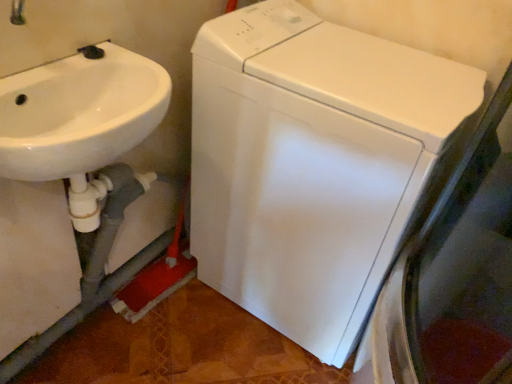
Image resolution: width=512 pixels, height=384 pixels. What do you see at coordinates (313, 164) in the screenshot?
I see `white glossy washing machine at center` at bounding box center [313, 164].

From the picture: Measure the distance between point (x=318, y=153) and camera.

The distance of point (x=318, y=153) from camera is 37.17 inches.

Find the location of a particular element. The height and width of the screenshot is (384, 512). white glossy washing machine at center is located at coordinates (313, 164).

In order to click on white glossy sink at left in this screenshot , I will do (79, 113).

What do you see at coordinates (79, 113) in the screenshot?
I see `white glossy sink at left` at bounding box center [79, 113].

This screenshot has width=512, height=384. I want to click on white glossy washing machine at center, so click(313, 164).

Can you confirm if white glossy sink at left is positioned to the left of white glossy washing machine at center?

Yes.

Does white glossy sink at left come behind white glossy washing machine at center?

No, it is in front of white glossy washing machine at center.

Does point (156, 114) appear closer or farther from the camera than point (244, 127)?

Clearly, point (156, 114) is closer to the camera than point (244, 127).

From the image's perspective, is white glossy sink at left positioned above or below white glossy washing machine at center?

From the image's perspective, white glossy sink at left appears above white glossy washing machine at center.

From a real-world perspective, which is physically above, white glossy sink at left or white glossy washing machine at center?

From a 3D spatial view, white glossy sink at left is above.

Which object is wider, white glossy sink at left or white glossy washing machine at center?

With larger width is white glossy washing machine at center.

Is white glossy sink at left taller or shorter than white glossy washing machine at center?

white glossy sink at left is shorter than white glossy washing machine at center.

Who is smaller, white glossy sink at left or white glossy washing machine at center?

Smaller between the two is white glossy sink at left.

Does white glossy sink at left contain white glossy washing machine at center?

Actually, white glossy washing machine at center is outside white glossy sink at left.

Is white glossy sink at left not near white glossy washing machine at center?

No, white glossy sink at left is in close proximity to white glossy washing machine at center.

Is white glossy sink at left facing towards white glossy washing machine at center?

No, white glossy sink at left is not turned towards white glossy washing machine at center.

Locate an element on the screen. The width and height of the screenshot is (512, 384). sink above the white glossy washing machine at center (from the image's perspective) is located at coordinates (79, 113).

Does white glossy washing machine at center appear on the left side of white glossy sink at left?

Incorrect, white glossy washing machine at center is not on the left side of white glossy sink at left.

Is white glossy washing machine at center in front of or behind white glossy sink at left in the image?

Clearly, white glossy washing machine at center is behind white glossy sink at left.

Does point (248, 284) come farther from viewer compared to point (30, 91)?

Yes.

From the image's perspective, would you say white glossy washing machine at center is shown under white glossy sink at left?

Indeed, from the image's perspective, white glossy washing machine at center is shown beneath white glossy sink at left.

From a real-world perspective, between white glossy washing machine at center and white glossy sink at left, who is vertically lower?

In real-world perspective, white glossy washing machine at center is lower.

Which of these two, white glossy washing machine at center or white glossy sink at left, is wider?

white glossy washing machine at center.

Considering the relative sizes of white glossy washing machine at center and white glossy sink at left in the image provided, is white glossy washing machine at center taller than white glossy sink at left?

Yes.

Is white glossy washing machine at center bigger or smaller than white glossy sink at left?

white glossy washing machine at center is bigger than white glossy sink at left.

Is white glossy washing machine at center positioned beyond the bounds of white glossy sink at left?

white glossy washing machine at center is positioned outside white glossy sink at left.

Is white glossy washing machine at center far away from white glossy sink at left?

white glossy washing machine at center is near white glossy sink at left, not far away.

Could you tell me if white glossy washing machine at center is facing white glossy sink at left?

Yes, white glossy washing machine at center is facing white glossy sink at left.

Consider the image. How different are the orientations of white glossy washing machine at center and white glossy sink at left in degrees?

The angular difference between white glossy washing machine at center and white glossy sink at left is 90.2 degrees.

Find the location of a particular element. The height and width of the screenshot is (384, 512). sink above the white glossy washing machine at center (from the image's perspective) is located at coordinates (79, 113).

Where is `sink in front of the white glossy washing machine at center`? sink in front of the white glossy washing machine at center is located at coordinates (79, 113).

The width and height of the screenshot is (512, 384). There is a white glossy washing machine at center. Identify the location of sink above it (from a real-world perspective). (79, 113).